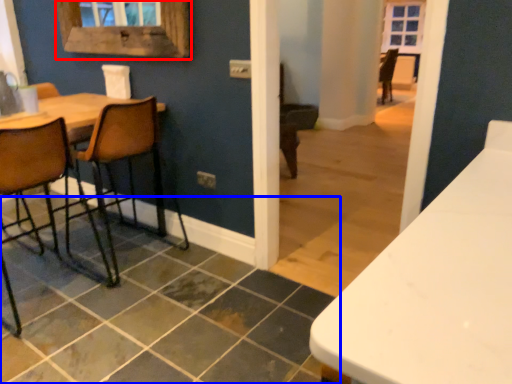
Question: Which of the following is the farthest to the observer, window frame (highlighted by a red box) or tile (highlighted by a blue box)?

Choices:
 (A) window frame
 (B) tile

Answer: (A)